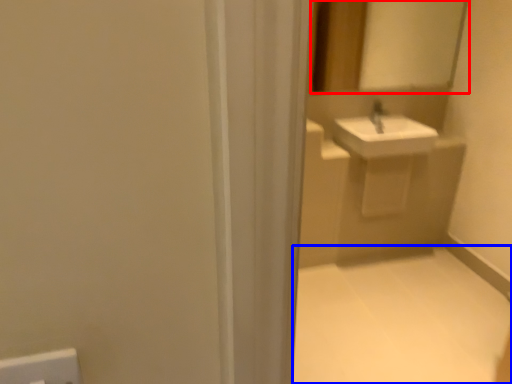
Question: Which object is further to the camera taking this photo, mirror (highlighted by a red box) or plain (highlighted by a blue box)?

Choices:
 (A) mirror
 (B) plain

Answer: (A)